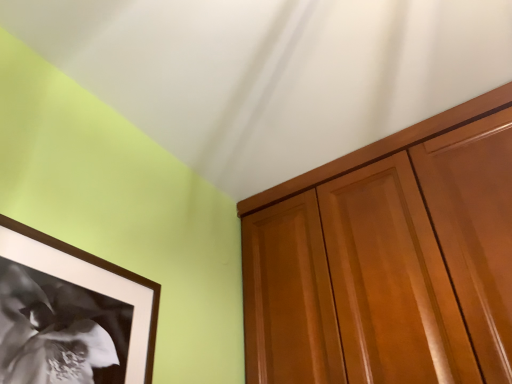
Question: Does black matte picture frame at lower left have a larger size compared to glossy wood cabinet at upper right?

Choices:
 (A) yes
 (B) no

Answer: (B)

Question: From a real-world perspective, does black matte picture frame at lower left sit lower than glossy wood cabinet at upper right?

Choices:
 (A) yes
 (B) no

Answer: (A)

Question: Is black matte picture frame at lower left aimed at glossy wood cabinet at upper right?

Choices:
 (A) no
 (B) yes

Answer: (A)

Question: Does black matte picture frame at lower left have a lesser width compared to glossy wood cabinet at upper right?

Choices:
 (A) yes
 (B) no

Answer: (A)

Question: From a real-world perspective, does black matte picture frame at lower left stand above glossy wood cabinet at upper right?

Choices:
 (A) yes
 (B) no

Answer: (B)

Question: From the image's perspective, would you say black matte picture frame at lower left is positioned over glossy wood cabinet at upper right?

Choices:
 (A) yes
 (B) no

Answer: (B)

Question: From a real-world perspective, is glossy wood cabinet at upper right below black matte picture frame at lower left?

Choices:
 (A) no
 (B) yes

Answer: (A)

Question: Is glossy wood cabinet at upper right closer to camera compared to black matte picture frame at lower left?

Choices:
 (A) yes
 (B) no

Answer: (B)

Question: From a real-world perspective, is glossy wood cabinet at upper right positioned over black matte picture frame at lower left based on gravity?

Choices:
 (A) no
 (B) yes

Answer: (B)

Question: Considering the relative sizes of glossy wood cabinet at upper right and black matte picture frame at lower left in the image provided, is glossy wood cabinet at upper right wider than black matte picture frame at lower left?

Choices:
 (A) no
 (B) yes

Answer: (B)

Question: Are glossy wood cabinet at upper right and black matte picture frame at lower left far apart?

Choices:
 (A) yes
 (B) no

Answer: (B)

Question: Could black matte picture frame at lower left be considered to be inside glossy wood cabinet at upper right?

Choices:
 (A) no
 (B) yes

Answer: (A)

Question: Relative to black matte picture frame at lower left, is glossy wood cabinet at upper right in front or behind?

Choices:
 (A) front
 (B) behind

Answer: (B)